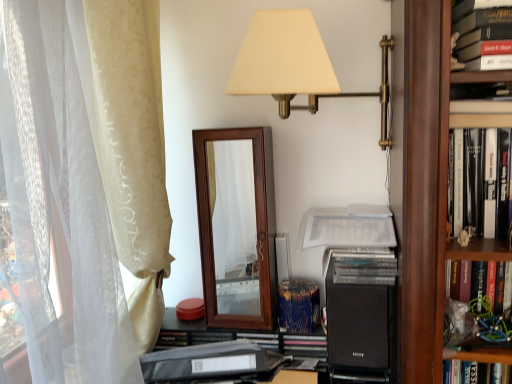
Question: Can you confirm if hardcover book at upper right, marked as the first book in a front-to-back arrangement, is taller than black plastic folder at lower center?

Choices:
 (A) yes
 (B) no

Answer: (A)

Question: Considering the relative sizes of hardcover book at upper right, placed as the first book when sorted from top to bottom, and black plastic folder at lower center in the image provided, is hardcover book at upper right, placed as the first book when sorted from top to bottom, shorter than black plastic folder at lower center?

Choices:
 (A) yes
 (B) no

Answer: (B)

Question: Does hardcover book at upper right, placed as the first book when sorted from top to bottom, have a larger size compared to black plastic folder at lower center?

Choices:
 (A) yes
 (B) no

Answer: (B)

Question: From the image's perspective, would you say hardcover book at upper right, the 2th book viewed from the back, is shown under black plastic folder at lower center?

Choices:
 (A) yes
 (B) no

Answer: (B)

Question: From a real-world perspective, is hardcover book at upper right, the 2th book viewed from the back, located beneath black plastic folder at lower center?

Choices:
 (A) yes
 (B) no

Answer: (B)

Question: Is hardcover book at upper right, placed as the first book when sorted from top to bottom, aimed at black plastic folder at lower center?

Choices:
 (A) no
 (B) yes

Answer: (A)

Question: Can you confirm if beige satin curtain at left is smaller than white paper at center?

Choices:
 (A) yes
 (B) no

Answer: (B)

Question: Does beige satin curtain at left have a lesser height compared to white paper at center?

Choices:
 (A) no
 (B) yes

Answer: (A)

Question: Is beige satin curtain at left placed right next to white paper at center?

Choices:
 (A) yes
 (B) no

Answer: (B)

Question: Is beige satin curtain at left wider than white paper at center?

Choices:
 (A) yes
 (B) no

Answer: (A)

Question: From a real-world perspective, does beige satin curtain at left stand above white paper at center?

Choices:
 (A) no
 (B) yes

Answer: (B)

Question: Is beige satin curtain at left positioned in front of white paper at center?

Choices:
 (A) no
 (B) yes

Answer: (B)

Question: Is the depth of hardcover book at right, the second book when ordered from top to bottom, greater than that of hardcover book at upper right, marked as the first book in a front-to-back arrangement?

Choices:
 (A) yes
 (B) no

Answer: (A)